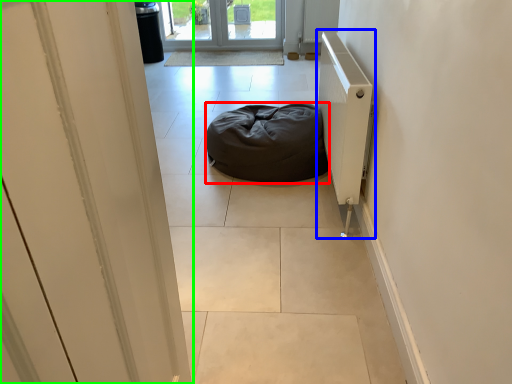
Question: Which is farther away from furniture (highlighted by a red box)? radiator (highlighted by a blue box) or door (highlighted by a green box)?

Choices:
 (A) radiator
 (B) door

Answer: (B)